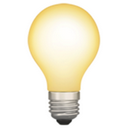
This screenshot has width=128, height=128. What are the coordinates of `wires` in the screenshot? It's located at (63, 80).